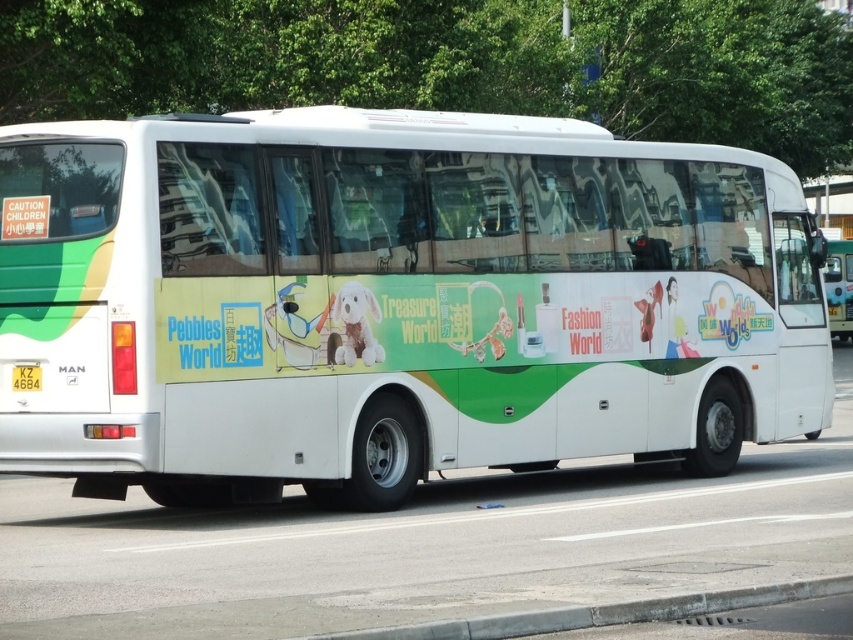
From the picture: You are a photographer trying to capture the license plate of the white glossy bus at right without the yellow plastic license plate at rear being in the frame. Is this possible?

The white glossy bus at right is positioned over the yellow plastic license plate at rear, so it is not possible to capture the license plate without the yellow plastic license plate at rear being in the frame.

You are standing at the center of the image. The white glossy bus at right is where?

The white glossy bus at right is located at the lower right side of the image.